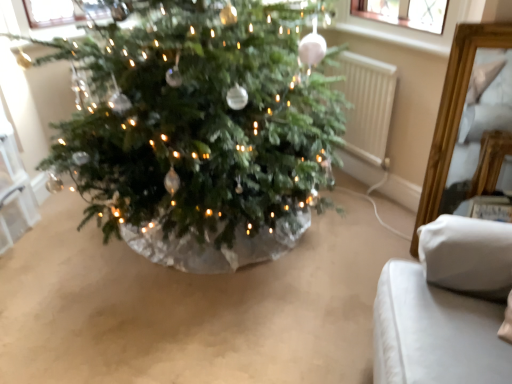
What do you see at coordinates (367, 104) in the screenshot? I see `white plastic radiator at center right` at bounding box center [367, 104].

The height and width of the screenshot is (384, 512). I want to click on white plastic radiator at center right, so click(x=367, y=104).

Identify the location of white fabric cushion at lower right. The height and width of the screenshot is (384, 512). (444, 308).

This screenshot has height=384, width=512. What do you see at coordinates (444, 308) in the screenshot?
I see `white fabric cushion at lower right` at bounding box center [444, 308].

Where is `white plastic radiator at center right`? white plastic radiator at center right is located at coordinates (367, 104).

Which is more to the left, white fabric cushion at lower right or white plastic radiator at center right?

white plastic radiator at center right is more to the left.

Which object is more forward, white fabric cushion at lower right or white plastic radiator at center right?

white fabric cushion at lower right is more forward.

Considering the positions of point (452, 239) and point (374, 145), is point (452, 239) closer or farther from the camera than point (374, 145)?

Clearly, point (452, 239) is closer to the camera than point (374, 145).

From the image's perspective, is white fabric cushion at lower right above white plastic radiator at center right?

No, from the image's perspective, white fabric cushion at lower right is not above white plastic radiator at center right.

From a real-world perspective, is white fabric cushion at lower right under white plastic radiator at center right?

Actually, white fabric cushion at lower right is physically above white plastic radiator at center right in the real world.

Does white fabric cushion at lower right have a lesser width compared to white plastic radiator at center right?

Incorrect, the width of white fabric cushion at lower right is not less than that of white plastic radiator at center right.

Can you confirm if white fabric cushion at lower right is taller than white plastic radiator at center right?

Yes, white fabric cushion at lower right is taller than white plastic radiator at center right.

Considering the relative sizes of white fabric cushion at lower right and white plastic radiator at center right in the image provided, is white fabric cushion at lower right bigger than white plastic radiator at center right?

Correct, white fabric cushion at lower right is larger in size than white plastic radiator at center right.

Can white plastic radiator at center right be found inside white fabric cushion at lower right?

No, white plastic radiator at center right is not surrounded by white fabric cushion at lower right.

Is white fabric cushion at lower right far from white plastic radiator at center right?

Yes, white fabric cushion at lower right and white plastic radiator at center right are located far from each other.

Could you tell me if white fabric cushion at lower right is turned towards white plastic radiator at center right?

No.

At what (x,y) coordinates should I click in order to perform the action: click on radiator behind the white fabric cushion at lower right. Please return your answer as a coordinate pair (x, y). Looking at the image, I should click on (367, 104).

Considering the relative positions of white plastic radiator at center right and white fabric cushion at lower right in the image provided, is white plastic radiator at center right to the left of white fabric cushion at lower right from the viewer's perspective?

Yes.

In the scene shown: Considering the positions of objects white plastic radiator at center right and white fabric cushion at lower right in the image provided, who is behind, white plastic radiator at center right or white fabric cushion at lower right?

white plastic radiator at center right is more distant.

Does point (358, 132) appear closer or farther from the camera than point (423, 237)?

Point (358, 132) appears to be farther away from the viewer than point (423, 237).

From the image's perspective, does white plastic radiator at center right appear higher than white fabric cushion at lower right?

Yes, from the image's perspective, white plastic radiator at center right is on top of white fabric cushion at lower right.

From a real-world perspective, who is located lower, white plastic radiator at center right or white fabric cushion at lower right?

white plastic radiator at center right.

Looking at their sizes, would you say white plastic radiator at center right is wider or thinner than white fabric cushion at lower right?

Considering their sizes, white plastic radiator at center right looks slimmer than white fabric cushion at lower right.

Based on the photo, which of these two, white plastic radiator at center right or white fabric cushion at lower right, stands shorter?

With less height is white plastic radiator at center right.

Does white plastic radiator at center right have a smaller size compared to white fabric cushion at lower right?

Yes.

Is white plastic radiator at center right positioned beyond the bounds of white fabric cushion at lower right?

Absolutely, white plastic radiator at center right is external to white fabric cushion at lower right.

Is white plastic radiator at center right positioned far away from white fabric cushion at lower right?

Yes, white plastic radiator at center right and white fabric cushion at lower right are located far from each other.

Is white plastic radiator at center right looking in the opposite direction of white fabric cushion at lower right?

white plastic radiator at center right does not have its back to white fabric cushion at lower right.

In the scene shown: How different are the orientations of white plastic radiator at center right and white fabric cushion at lower right in degrees?

16 degrees separate the facing orientations of white plastic radiator at center right and white fabric cushion at lower right.

Locate an element on the screen. This screenshot has width=512, height=384. radiator behind the white fabric cushion at lower right is located at coordinates (367, 104).

The width and height of the screenshot is (512, 384). Find the location of `furniture located above the white plastic radiator at center right (from a real-world perspective)`. furniture located above the white plastic radiator at center right (from a real-world perspective) is located at coordinates (444, 308).

At what (x,y) coordinates should I click in order to perform the action: click on furniture that appears below the white plastic radiator at center right (from the image's perspective). Please return your answer as a coordinate pair (x, y). Looking at the image, I should click on (444, 308).